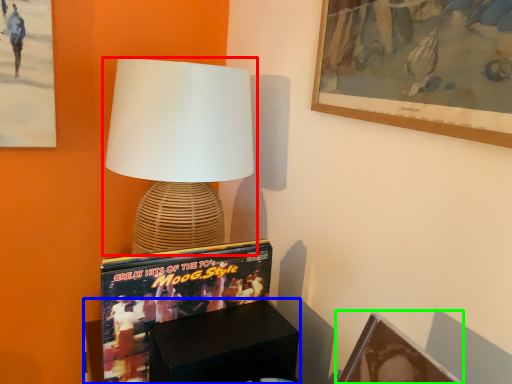
Question: Considering the real-world distances, which object is closest to lamp (highlighted by a red box)? furniture (highlighted by a blue box) or picture frame (highlighted by a green box).

Choices:
 (A) furniture
 (B) picture frame

Answer: (A)